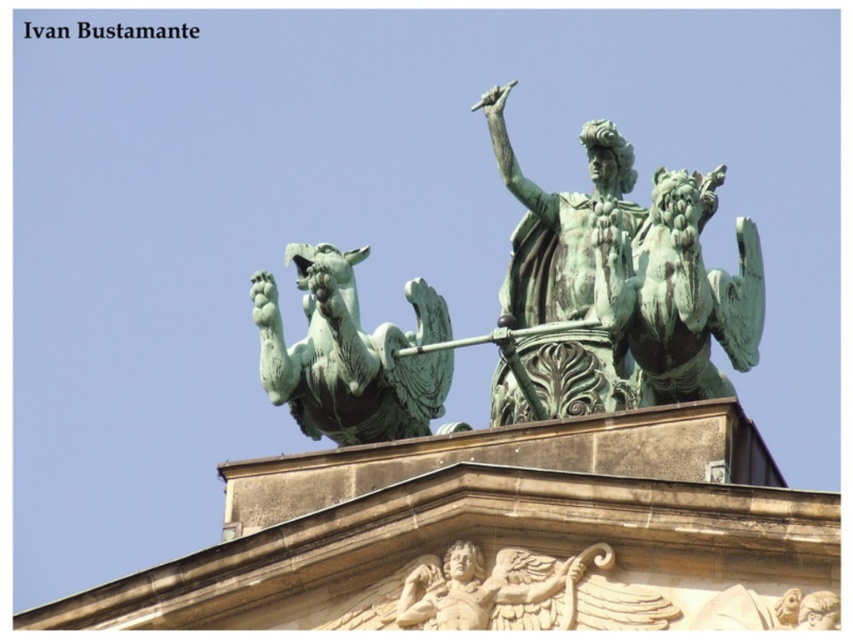
Can you confirm if green patina statue at upper center is positioned to the left of green patina griffin at upper left?

Incorrect, green patina statue at upper center is not on the left side of green patina griffin at upper left.

In the scene shown: Is green patina statue at upper center bigger than green patina griffin at upper left?

Yes, green patina statue at upper center is bigger than green patina griffin at upper left.

Is point (604, 195) farther from viewer compared to point (305, 424)?

Yes, it is.

Identify the location of green patina statue at upper center. (631, 266).